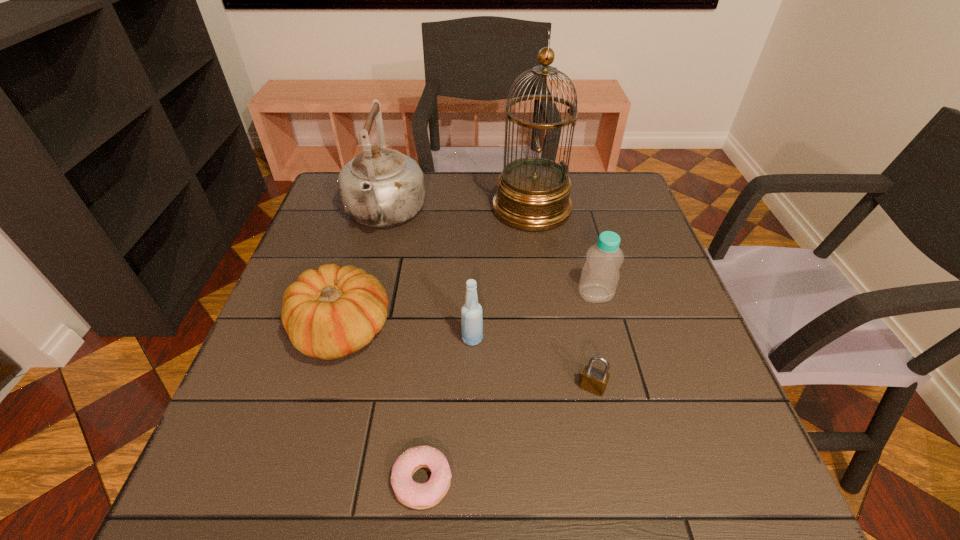
This screenshot has width=960, height=540. Identify the location of free location at the far right corner. (631, 190).

You are a GUI agent. You are given a task and a screenshot of the screen. Output one action in this format:
    pyautogui.click(x=<x>, y=<y>)
    Task: Click on the free space at the near right corner of the desktop
    The image size is (960, 540).
    Given the screenshot: What is the action you would take?
    (770, 499)

The image size is (960, 540). I want to click on empty location between the padlock and the tallest object, so click(x=562, y=298).

This screenshot has width=960, height=540. I want to click on free point between the sixth shortest object and the doughnut, so click(403, 348).

What are the coordinates of `free space between the nearer bottle and the birdcage` in the screenshot? It's located at (502, 274).

Identify the location of empty location between the sixth shortest object and the padlock. The height and width of the screenshot is (540, 960). (489, 301).

Find the location of a particular element. Image resolution: width=960 pixels, height=540 pixels. free spot between the doughnut and the kettle is located at coordinates (403, 348).

You are a GUI agent. You are given a task and a screenshot of the screen. Output one action in this format:
    pyautogui.click(x=<x>, y=<y>)
    Task: Click on the free space between the second shortest object and the tallest object
    Image resolution: width=960 pixels, height=540 pixels.
    Given the screenshot: What is the action you would take?
    pyautogui.click(x=562, y=298)

Where is `vacant point located between the right bottle and the doughnut`? vacant point located between the right bottle and the doughnut is located at coordinates (509, 388).

Find the location of a particular element. The image size is (960, 540). vacant area that lies between the tallest object and the right bottle is located at coordinates (564, 251).